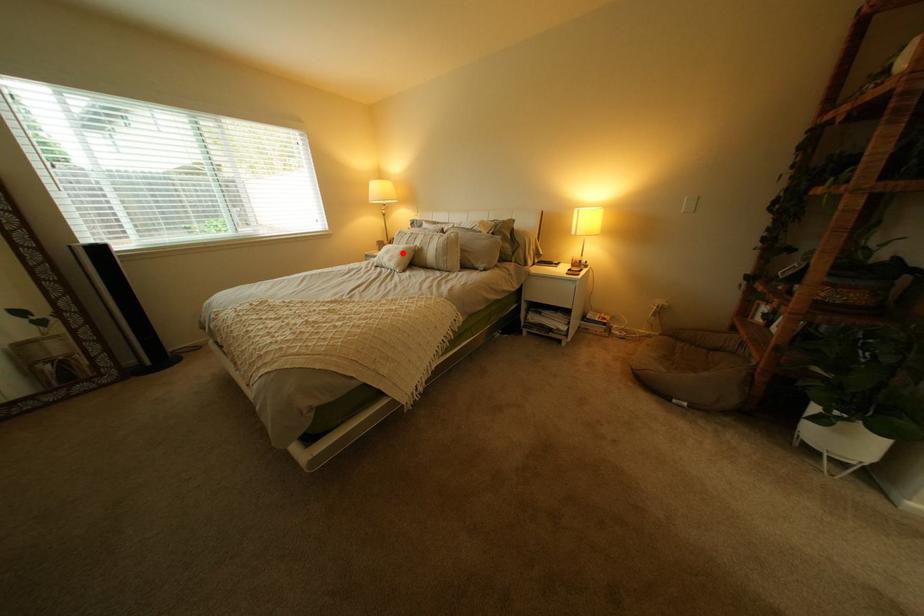
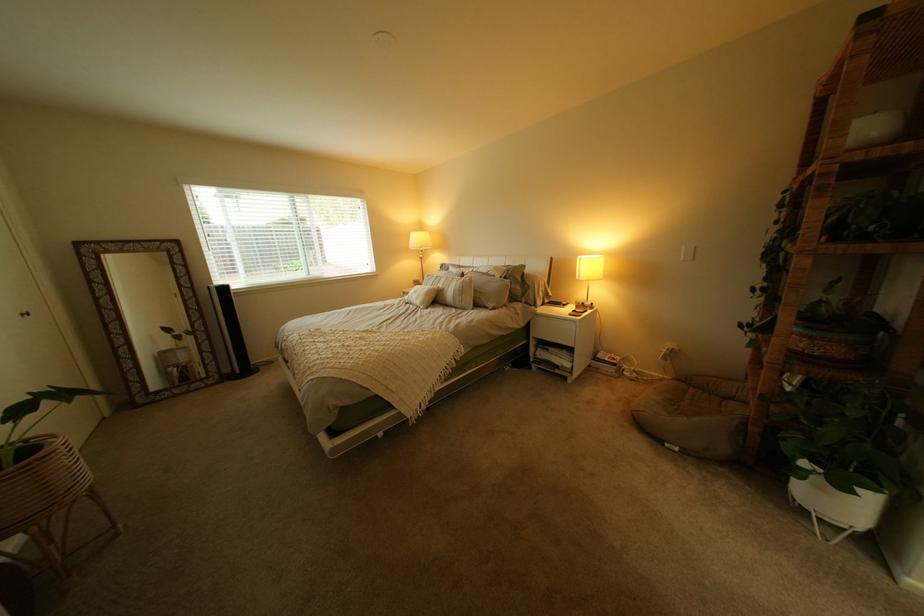
In the second image, find the point that corresponds to the highlighted location in the first image.

(431, 293)